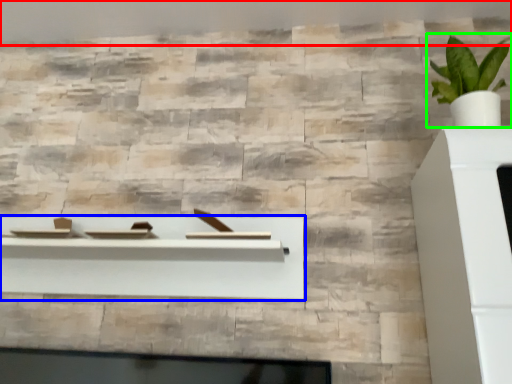
Question: Based on their relative distances, which object is nearer to backdrop (highlighted by a red box)? Choose from shelf (highlighted by a blue box) and houseplant (highlighted by a green box).

Choices:
 (A) shelf
 (B) houseplant

Answer: (B)